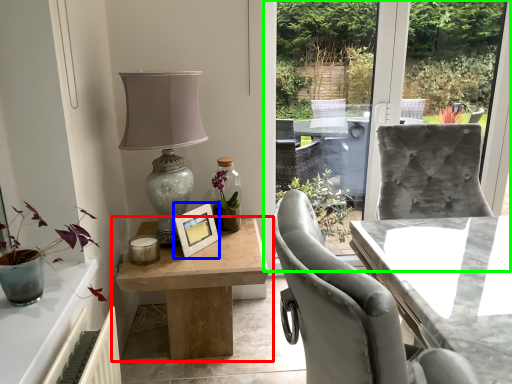
Question: Which object is positioned farthest from table (highlighted by a red box)? Select from picture frame (highlighted by a blue box) and window screen (highlighted by a green box).

Choices:
 (A) picture frame
 (B) window screen

Answer: (B)